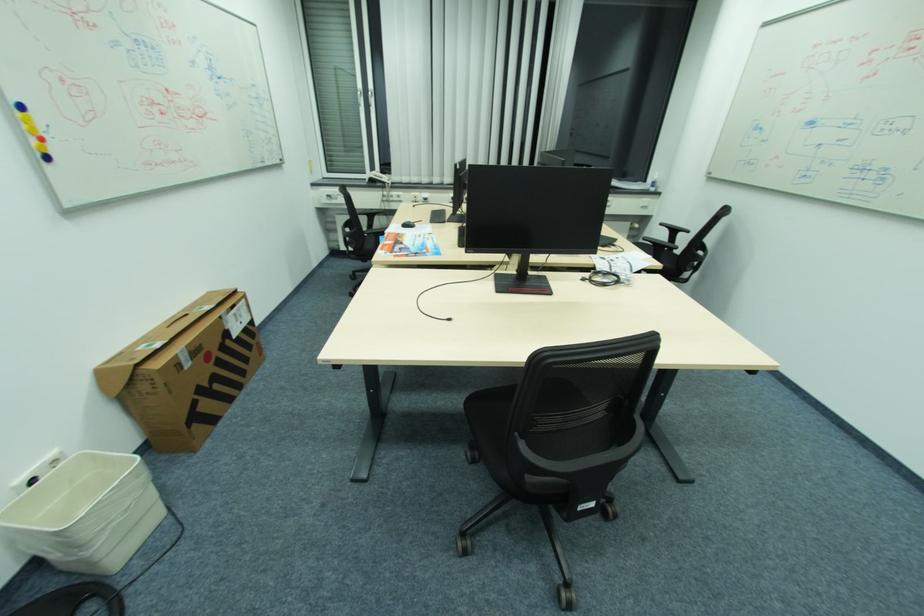
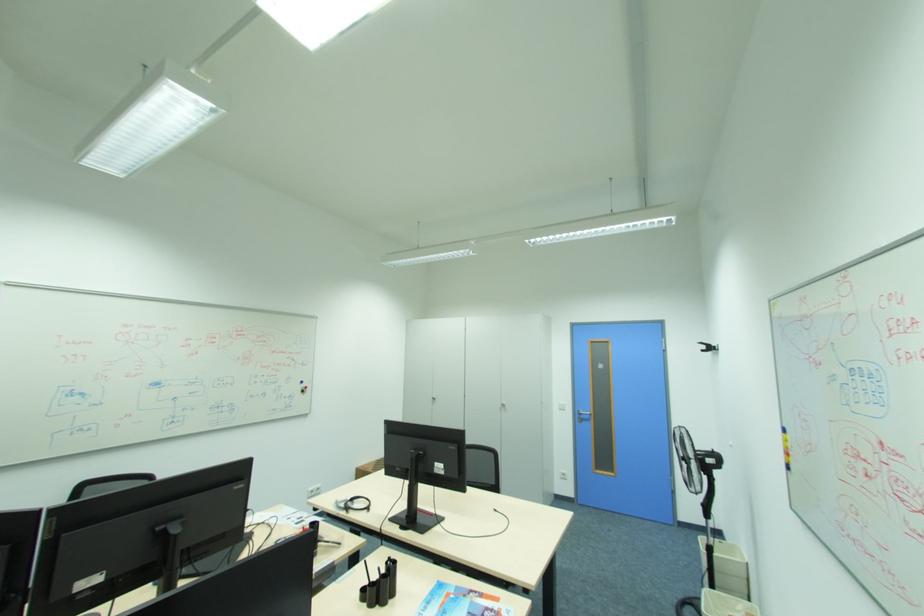
In the second image, find the point that corresponds to pixel 43 128 in the first image.

(794, 446)